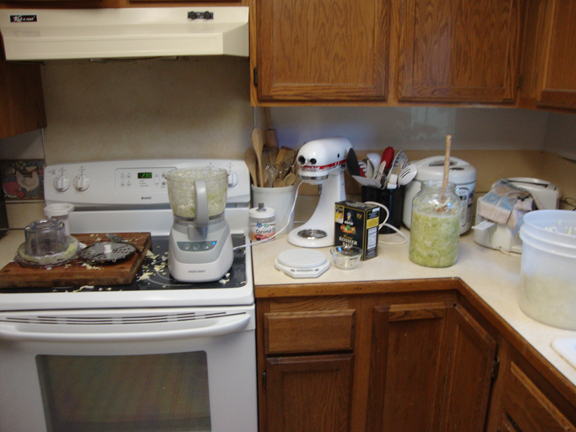
Identify the location of cutting board. (115, 275).